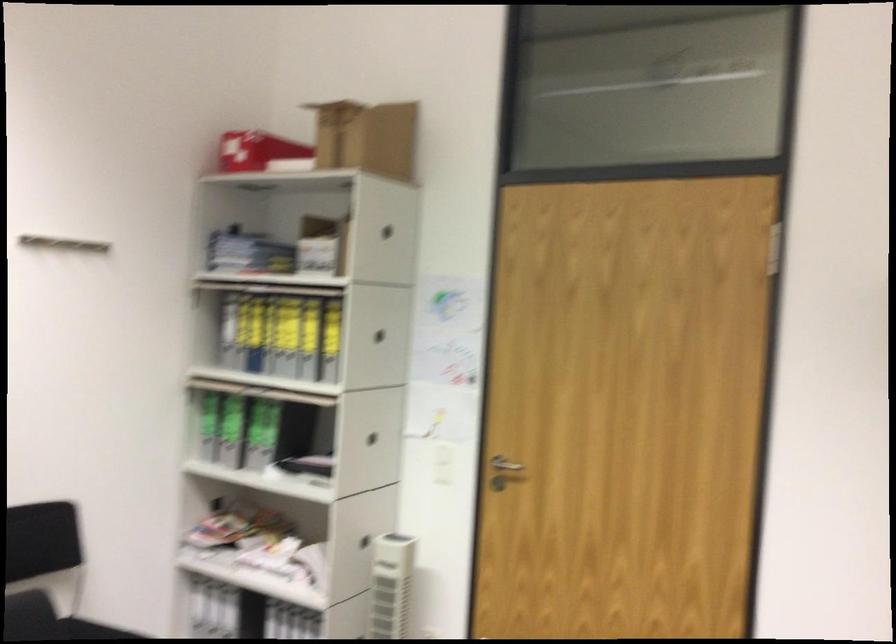
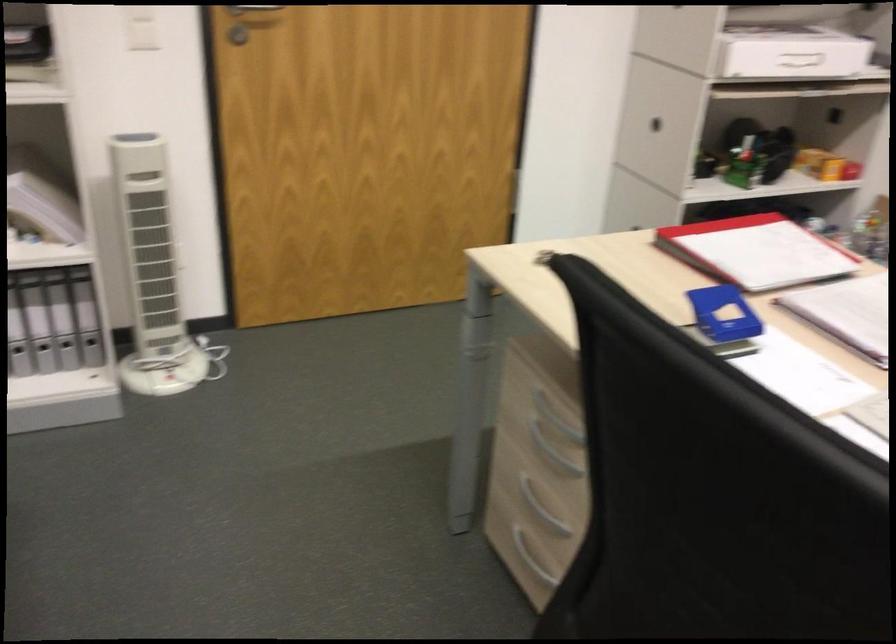
Question: I am providing you with two images of the same scene from different viewpoints. After the viewpoint changes to image2, which objects are now occluded?

Choices:
 (A) conference phone handset
 (B) chair sitting surface
 (C) white tower fan
 (D) silver door handle

Answer: (B)